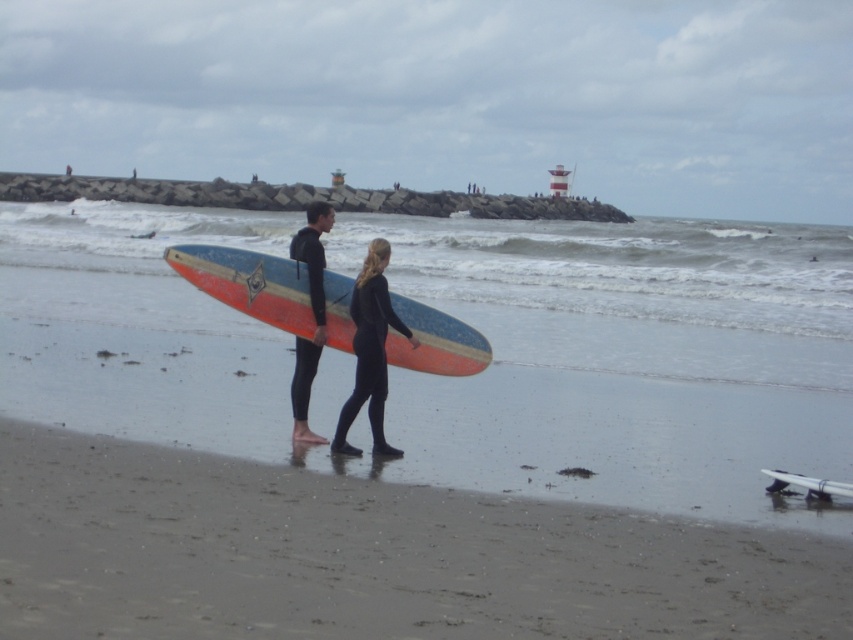
Question: Which of these objects is positioned farthest from the black wetsuit at center?

Choices:
 (A) matte wood surfboard at center
 (B) white glossy surfboard at lower right
 (C) black matte wetsuit at center
 (D) wooden surfboard at center

Answer: (B)

Question: Can you confirm if matte wood surfboard at center is wider than wooden surfboard at center?

Choices:
 (A) yes
 (B) no

Answer: (A)

Question: Is black wetsuit at center smaller than white glossy surfboard at lower right?

Choices:
 (A) no
 (B) yes

Answer: (A)

Question: Which object appears closest to the camera in this image?

Choices:
 (A) white glossy surfboard at lower right
 (B) black matte wetsuit at center
 (C) black wetsuit at center
 (D) matte wood surfboard at center

Answer: (D)

Question: Which of the following is the closest to the observer?

Choices:
 (A) black matte wetsuit at center
 (B) black wetsuit at center
 (C) white glossy surfboard at lower right
 (D) matte wood surfboard at center

Answer: (D)

Question: From the image, what is the correct spatial relationship of matte wood surfboard at center in relation to wooden surfboard at center?

Choices:
 (A) left
 (B) right

Answer: (A)